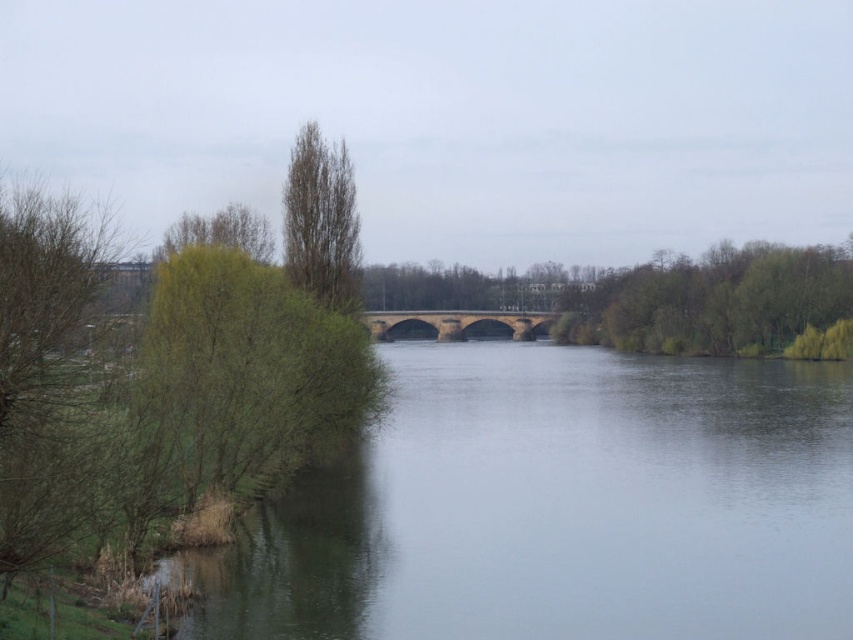
Question: Estimate the real-world distances between objects in this image. Which object is farther from the brown textured tree at upper center?

Choices:
 (A) clear water at center
 (B) green leafy tree at upper right

Answer: (B)

Question: Can you confirm if clear water at center is positioned above green leafy tree at upper right?

Choices:
 (A) no
 (B) yes

Answer: (A)

Question: Which is nearer to the clear water at center?

Choices:
 (A) brown textured tree at upper center
 (B) green leafy tree at upper right

Answer: (A)

Question: Which is nearer to the clear water at center?

Choices:
 (A) brown textured tree at upper center
 (B) green leafy tree at upper right

Answer: (A)

Question: Can you confirm if green leafy tree at upper right is positioned below brown textured tree at upper center?

Choices:
 (A) no
 (B) yes

Answer: (A)

Question: Can you confirm if green leafy tree at upper right is bigger than brown textured tree at upper center?

Choices:
 (A) no
 (B) yes

Answer: (B)